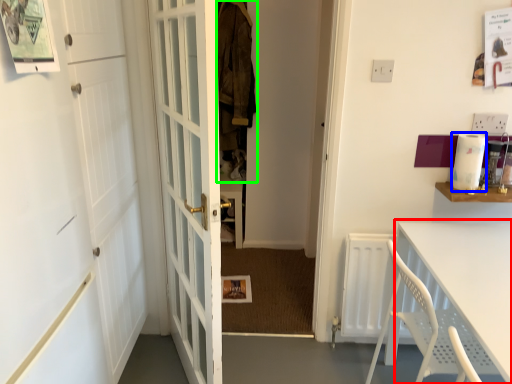
Question: Estimate the real-world distances between objects in this image. Which object is farther from table (highlighted by a red box), appliance (highlighted by a blue box) or laundry (highlighted by a green box)?

Choices:
 (A) appliance
 (B) laundry

Answer: (B)